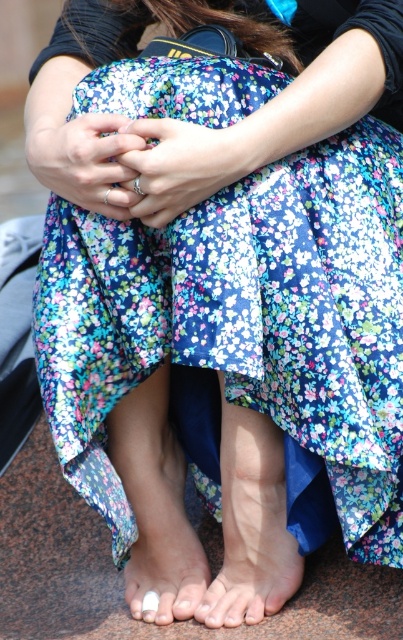
Can you confirm if floral fabric dress at center is wider than dry skin foot at lower center?

Indeed, floral fabric dress at center has a greater width compared to dry skin foot at lower center.

Is floral fabric dress at center thinner than dry skin foot at lower center?

Incorrect, floral fabric dress at center's width is not less than dry skin foot at lower center's.

This screenshot has height=640, width=403. Identify the location of floral fabric dress at center. pos(243,323).

Between floral fabric dress at center and white matte nail at center, which one appears on the left side from the viewer's perspective?

white matte nail at center

I want to click on floral fabric dress at center, so click(x=243, y=323).

You are a GUI agent. You are given a task and a screenshot of the screen. Output one action in this format:
    pyautogui.click(x=<x>, y=<y>)
    Task: Click on the floral fabric dress at center
    
    Given the screenshot: What is the action you would take?
    pyautogui.click(x=243, y=323)

In the scene shown: Does dry skin foot at lower center have a smaller size compared to white matte nail at center?

No.

Is dry skin foot at lower center above white matte nail at center?

Correct, dry skin foot at lower center is located above white matte nail at center.

Between point (280, 532) and point (189, 532), which one is positioned in front?

Positioned in front is point (280, 532).

What are the coordinates of `dry skin foot at lower center` in the screenshot? It's located at (251, 573).